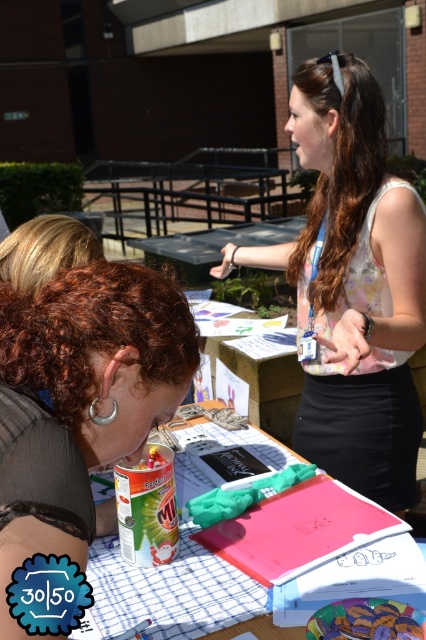
You are a photographer at the event and need to capture a clear photo of both the curly hair at center and the pink matte folder at center. Since the curly hair is blocking the folder, can you adjust your angle to see the folder without moving any objects?

The curly hair at center is positioned over the pink matte folder at center, so adjusting the angle downward might allow you to see the folder beneath without moving anything.

You are standing at the table in the scene. There are two points marked on the table surface. One is at coordinate point (29, 388) and the other is at point (218, 564). Which point is closer to you?

Point (29, 388) is closer to the viewer than point (218, 564).

You are organizing materials for an event and notice the pink matte folder at center and the matte plastic toy at center on the table. Which object is taller?

The pink matte folder at center is much taller than the matte plastic toy at center.